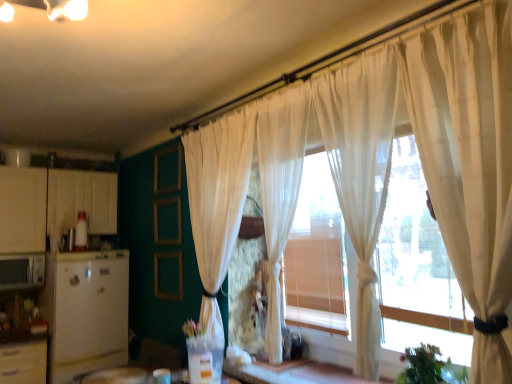
Question: Is translucent wood window frame at center inside or outside of sheer white curtain at right, which ranks as the first curtain in right-to-left order?

Choices:
 (A) outside
 (B) inside

Answer: (A)

Question: Is point (404, 339) closer or farther from the camera than point (454, 112)?

Choices:
 (A) closer
 (B) farther

Answer: (B)

Question: Which object is positioned farthest from the sheer white curtain at center, which appears as the 2th curtain when viewed from the left?

Choices:
 (A) green leafy plant at lower right
 (B) white matte cabinet at left
 (C) translucent wood window frame at center
 (D) matte white microwave at left, the first appliance positioned from the left
 (E) sheer white curtain at right, which ranks as the first curtain in right-to-left order

Answer: (D)

Question: Estimate the real-world distances between objects in this image. Which object is farther from the green leafy plant at lower right?

Choices:
 (A) white matte refrigerator at left, positioned as the second appliance in left-to-right order
 (B) sheer white curtain at center, which is the fourth curtain in right-to-left order
 (C) translucent wood window frame at center
 (D) sheer white curtain at right, placed as the 4th curtain when sorted from left to right
 (E) sheer white curtain at center, the third curtain in the left-to-right sequence

Answer: (A)